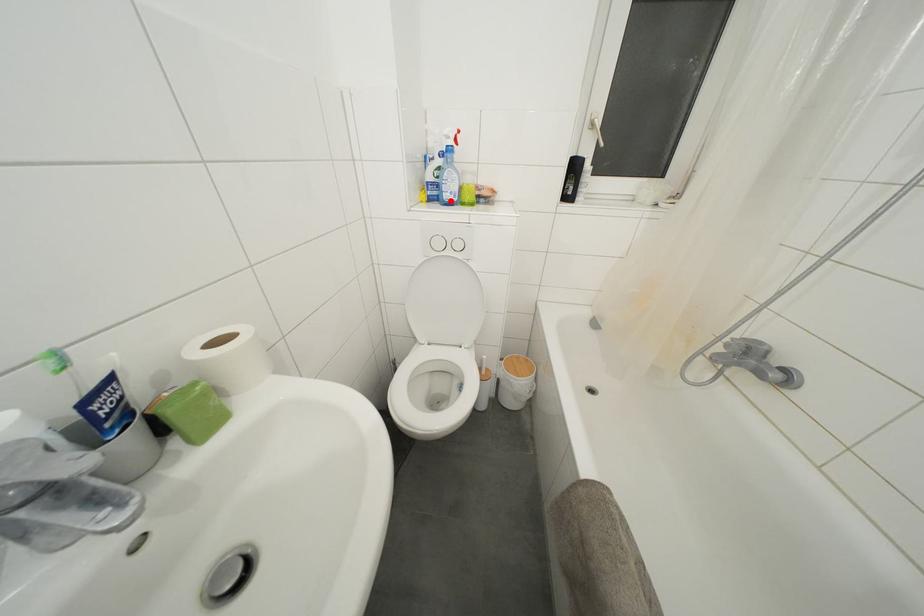
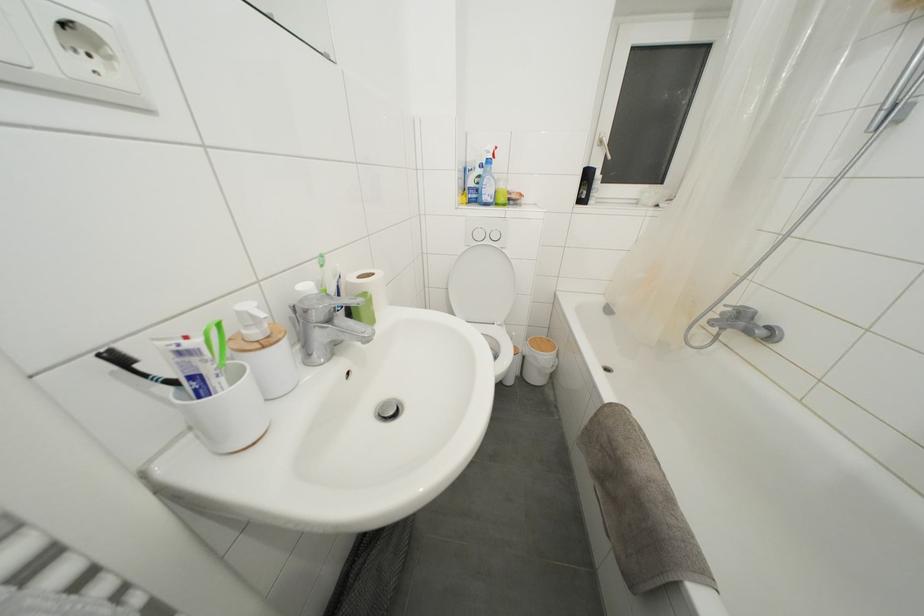
In the second image, find the point that corresponds to the highlighted location in the first image.

(490, 203)